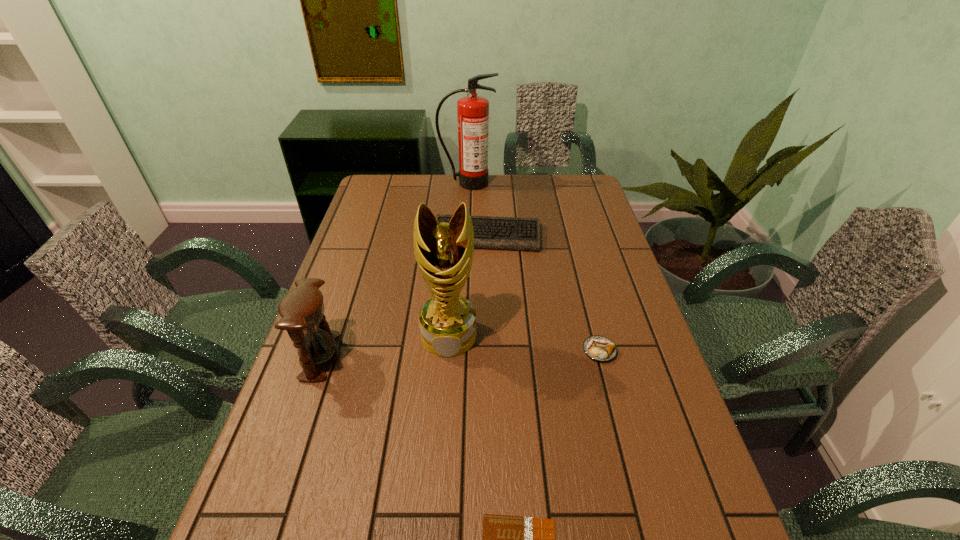
Find the location of a particular element. blank area located 0.330m on the right of the hourglass is located at coordinates (467, 356).

Locate an element on the screen. This screenshot has width=960, height=540. vacant space located on the back of the second farthest object is located at coordinates (486, 204).

Where is `vacant space located 0.220m on the front of the pastry`? This screenshot has width=960, height=540. vacant space located 0.220m on the front of the pastry is located at coordinates (624, 446).

Where is `object that is at the far edge`? The width and height of the screenshot is (960, 540). object that is at the far edge is located at coordinates (472, 111).

Where is `object at the left edge`? The height and width of the screenshot is (540, 960). object at the left edge is located at coordinates (302, 309).

Find the location of a particular element. object present at the right edge is located at coordinates (599, 348).

At what (x,y) coordinates should I click in order to perform the action: click on vacant area at the far edge of the desktop. Please return your answer as a coordinate pair (x, y). This screenshot has width=960, height=540. Looking at the image, I should click on (484, 197).

At what (x,y) coordinates should I click in order to perform the action: click on blank space at the left edge. Please return your answer as a coordinate pair (x, y). This screenshot has height=540, width=960. Looking at the image, I should click on (268, 477).

Where is `vacant space at the right edge`? vacant space at the right edge is located at coordinates pos(567,234).

Identify the location of unoccupied area between the fire extinguisher and the fifth nearest object. (477, 210).